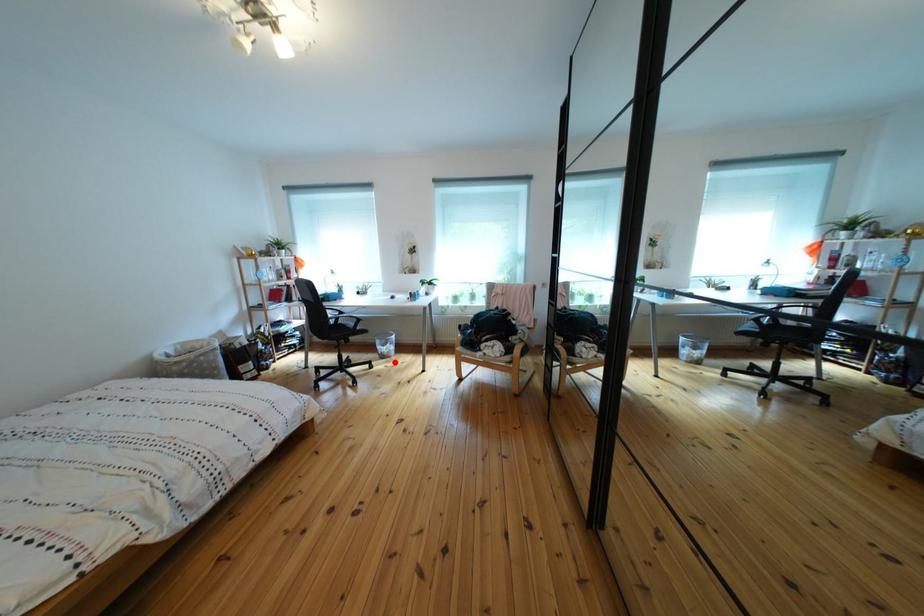
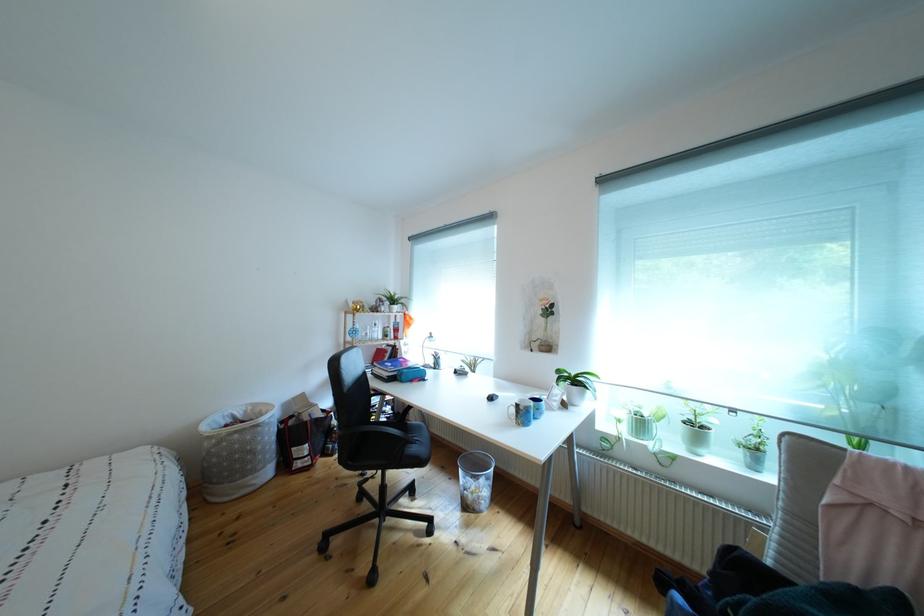
The point at the highlighted location is marked in the first image. Where is the corresponding point in the second image?

(477, 512)